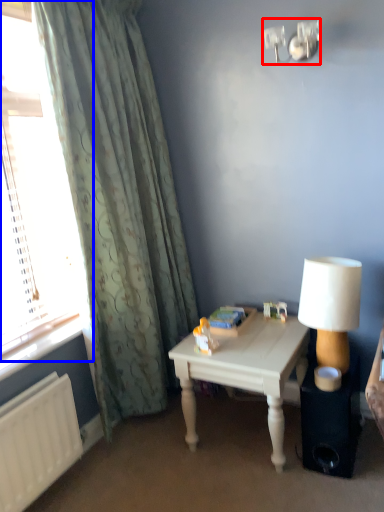
Question: Which object appears farthest to the camera in this image, fixture (highlighted by a red box) or window (highlighted by a blue box)?

Choices:
 (A) fixture
 (B) window

Answer: (A)